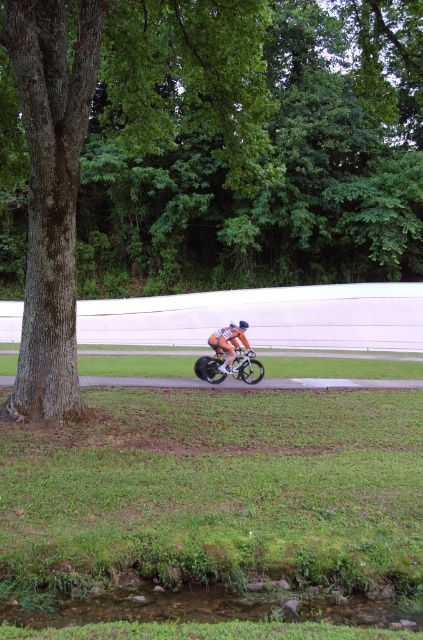
Question: Is shiny metallic bicycle at center wider than orange reflective suit at center?

Choices:
 (A) yes
 (B) no

Answer: (B)

Question: Is green rough bark tree at left to the left of orange reflective suit at center from the viewer's perspective?

Choices:
 (A) yes
 (B) no

Answer: (A)

Question: Which object is the closest to the green rough bark tree at left?

Choices:
 (A) orange reflective suit at center
 (B) shiny metallic bicycle at center

Answer: (A)

Question: Is shiny metallic bicycle at center wider than orange reflective suit at center?

Choices:
 (A) yes
 (B) no

Answer: (B)

Question: Which of the following is the farthest from the observer?

Choices:
 (A) (195, 364)
 (B) (187, 77)

Answer: (B)

Question: Which object appears closest to the camera in this image?

Choices:
 (A) green rough bark tree at left
 (B) shiny metallic bicycle at center
 (C) orange reflective suit at center

Answer: (A)